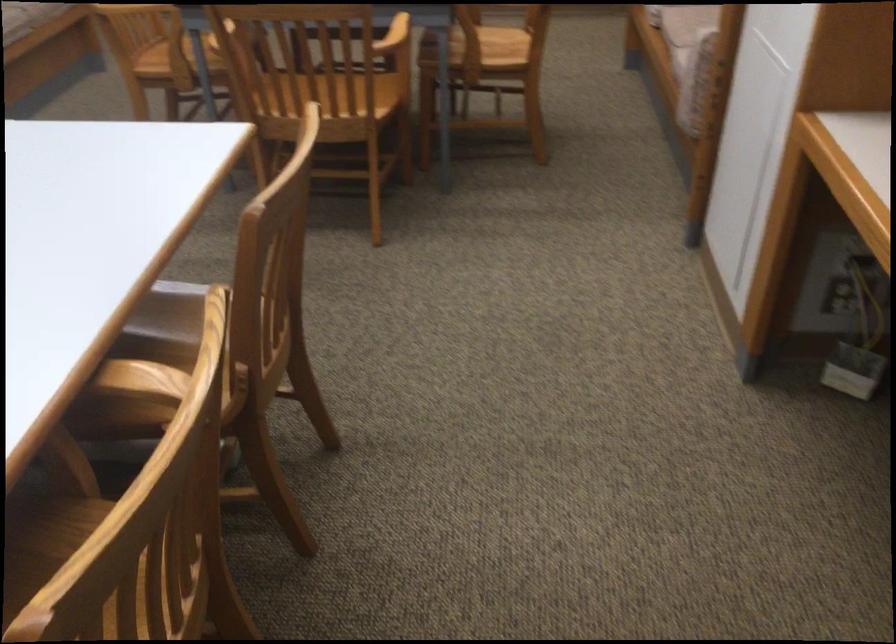
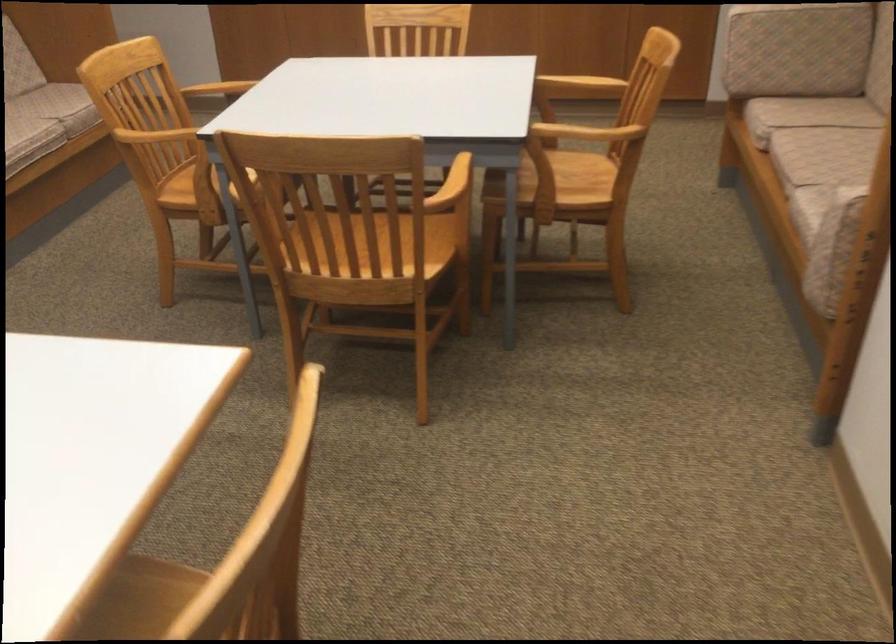
The point at [313,98] is marked in the first image. Where is the corresponding point in the second image?

(358, 259)